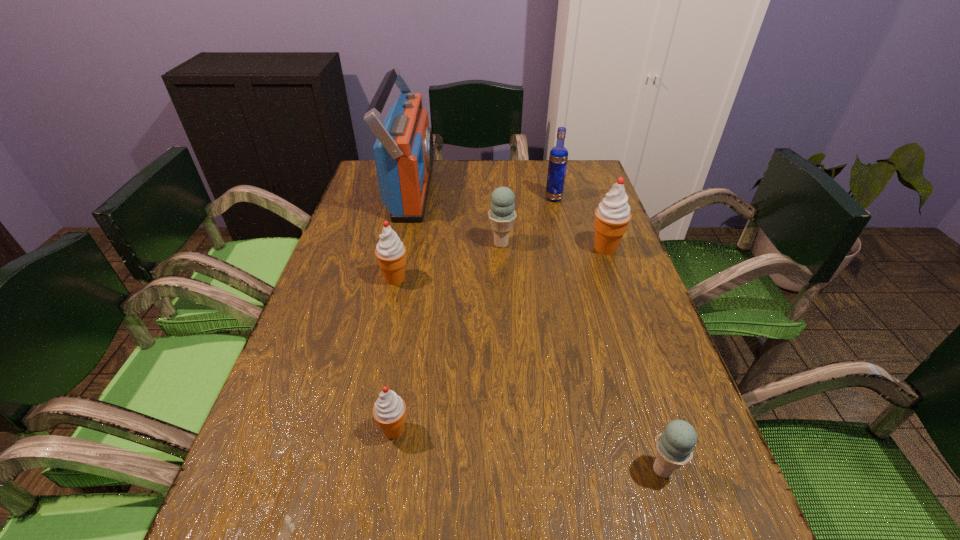
The height and width of the screenshot is (540, 960). I want to click on vacant space at the right edge of the desktop, so click(x=595, y=204).

In the image, there is a desktop. Where is `vacant space at the far left corner`? This screenshot has width=960, height=540. vacant space at the far left corner is located at coordinates (374, 174).

You are a GUI agent. You are given a task and a screenshot of the screen. Output one action in this format:
    pyautogui.click(x=<x>, y=<y>)
    Task: Click on the empty space that is in between the second nearest ice cream and the vodka
    
    Given the screenshot: What is the action you would take?
    474,314

Find the location of `free spot between the nearest object and the fifth object from left to right`. free spot between the nearest object and the fifth object from left to right is located at coordinates (608, 334).

Where is `vacant area that lies between the blue vodka and the second nearest red icecream`? This screenshot has width=960, height=540. vacant area that lies between the blue vodka and the second nearest red icecream is located at coordinates pyautogui.click(x=474, y=239).

Locate an element on the screen. This screenshot has height=540, width=960. free spot between the smaller blue ice cream and the vodka is located at coordinates (608, 334).

Where is `free spot between the fifth object from left to right and the second nearest ice cream`? This screenshot has height=540, width=960. free spot between the fifth object from left to right and the second nearest ice cream is located at coordinates (474, 314).

Identify the location of unoccupied position between the right blue ice cream and the third nearest object. The image size is (960, 540). (529, 374).

Locate which object ranks fourth in proximity to the smallest red icecream. Please provide its 2D coordinates. Your answer should be formatted as a tuple, i.e. [(x, y)], where the tuple contains the x and y coordinates of a point satisfying the conditions above.

[(404, 150)]

The width and height of the screenshot is (960, 540). Find the location of `the sixth closest object relative to the farthest red icecream`. the sixth closest object relative to the farthest red icecream is located at coordinates click(x=389, y=411).